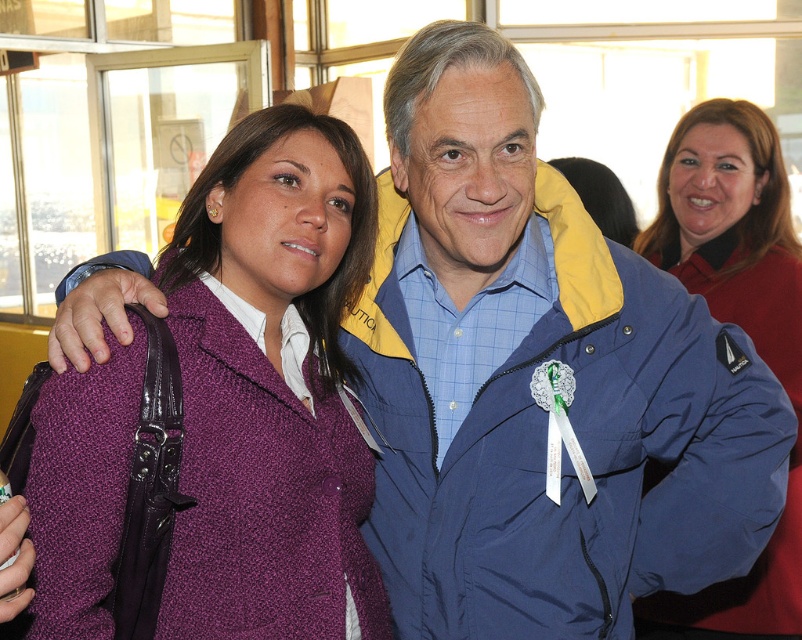
You are at a party and want to hand a gift to the person wearing the purple fleece jacket at left without touching the matte red shirt at upper right. Is this possible?

The matte red shirt at upper right is positioned over the purple fleece jacket at left, so you cannot hand the gift to the purple fleece jacket at left without touching the matte red shirt at upper right.

You are a photographer at a crowded event and need to capture a photo of both the matte red shirt at upper right and the purple fleece jacket at left in the same frame. The camera you are using has a maximum focal length that allows capturing objects up to 1.5 meters apart. Will you be able to include both subjects in the photo?

The matte red shirt at upper right is 1.58 meters from the purple fleece jacket at left. Since the distance between them exceeds the camera maximum focal length of 1.5 meters, you won let both subjects in the same frame.